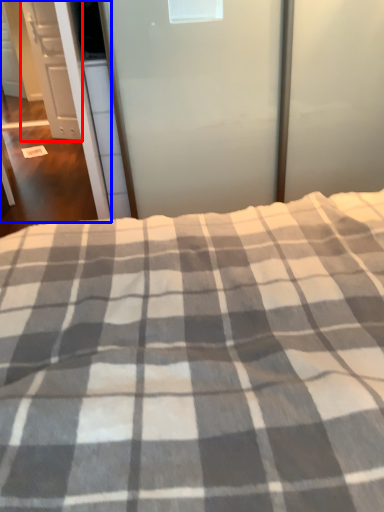
Question: Which object is further to the camera taking this photo, cabinetry (highlighted by a red box) or screen door (highlighted by a blue box)?

Choices:
 (A) cabinetry
 (B) screen door

Answer: (A)